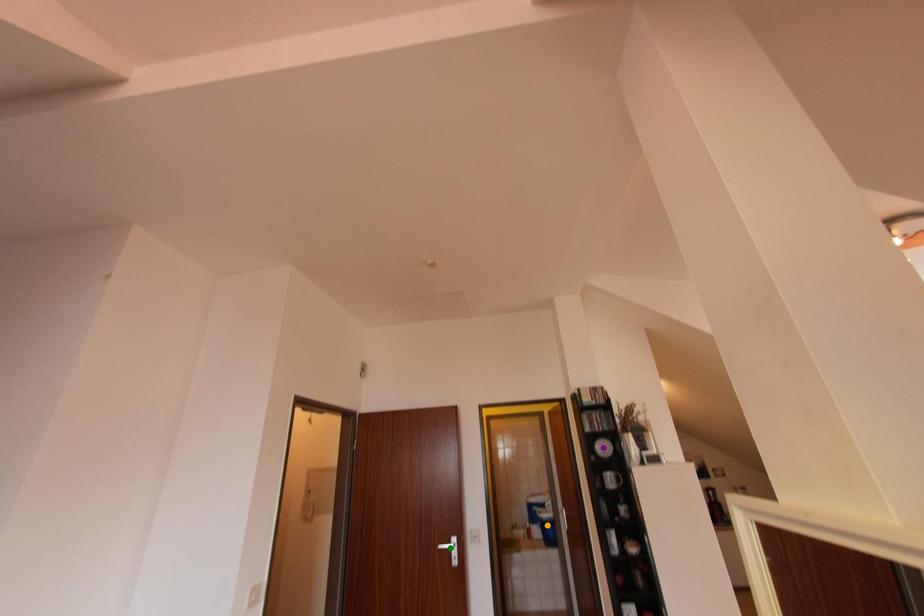
Order these from nearest to farthest:
1. green point
2. purple point
3. orange point

purple point
green point
orange point